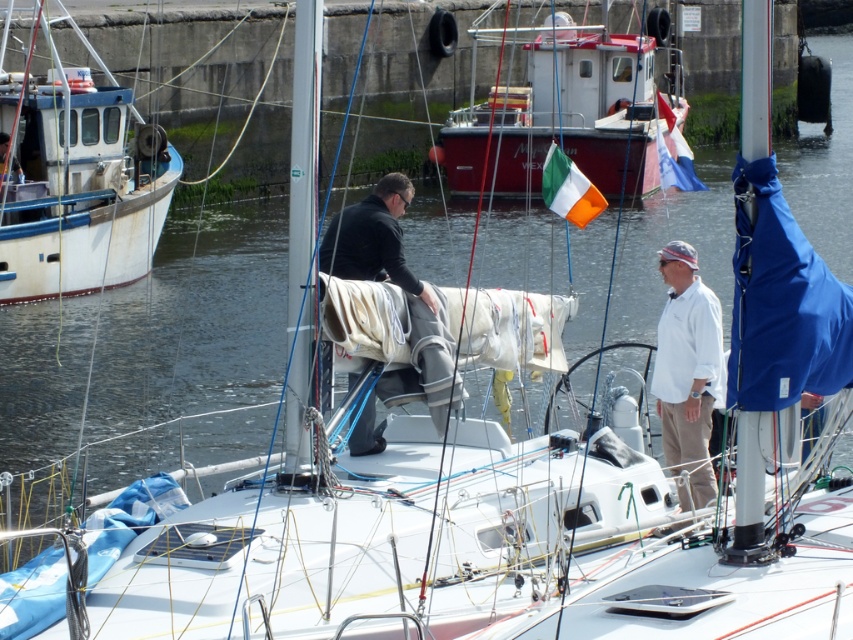
You are a tour guide on a sightseeing boat approaching the marina. You need to dock your boat between the white matte boat at left and the red metallic boat at upper center. The length of your boat is 12 meters. Can your boat fit in the space between them?

The distance between the white matte boat at left and the red metallic boat at upper center is 26.23 meters. Since your boat is only 12 meters long, there is sufficient space to dock between them.

You are a photographer positioned at the marina and want to take a photo of the white cotton shirt at center and the red metallic boat at upper center. Based on their positions, which object should appear closer to the camera in the photo?

The red metallic boat at upper center appears closer to the camera because the white cotton shirt at center is behind it.